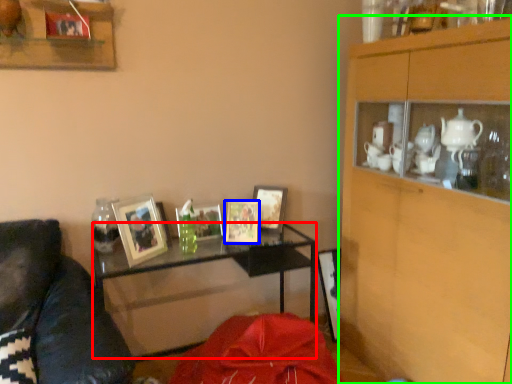
Question: Considering the real-world distances, which object is farthest from desk (highlighted by a red box)? picture frame (highlighted by a blue box) or cabinetry (highlighted by a green box)?

Choices:
 (A) picture frame
 (B) cabinetry

Answer: (B)